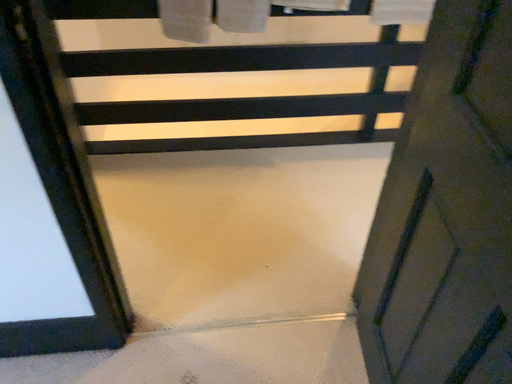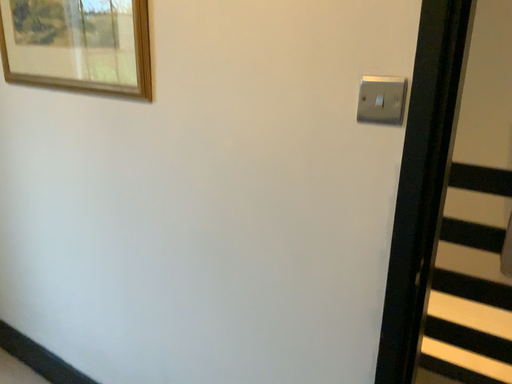
Question: Which way did the camera rotate in the video?

Choices:
 (A) rotated left
 (B) rotated right

Answer: (A)